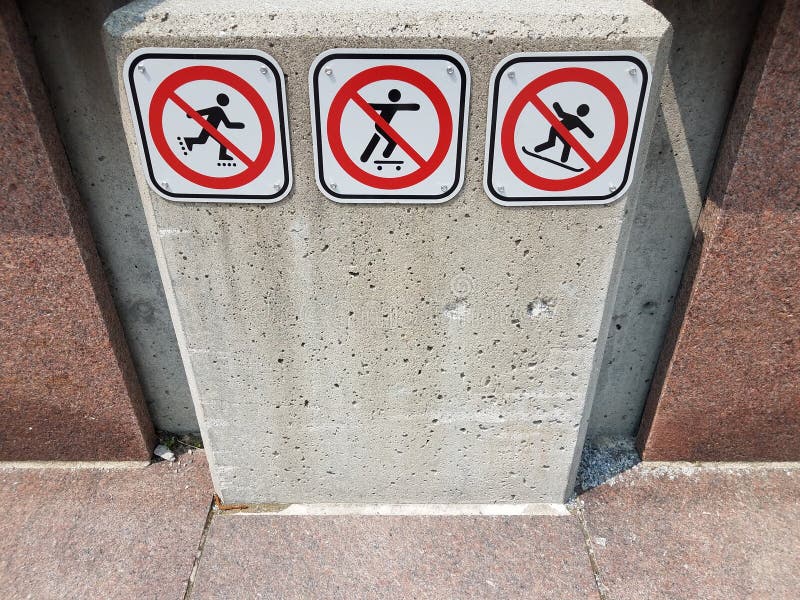
Where is `dark red wall`? Image resolution: width=800 pixels, height=600 pixels. dark red wall is located at coordinates (26, 209), (780, 227), (46, 354), (761, 325).